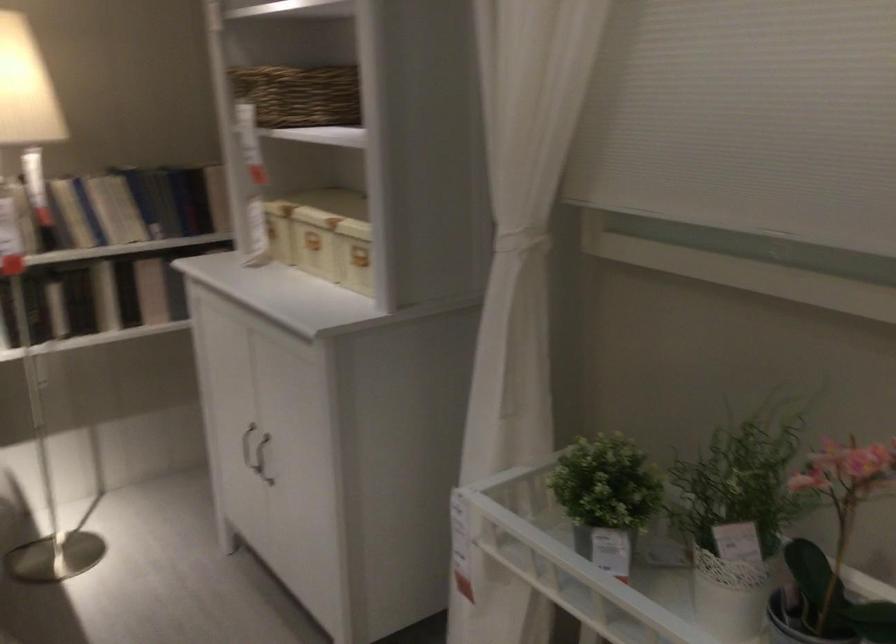
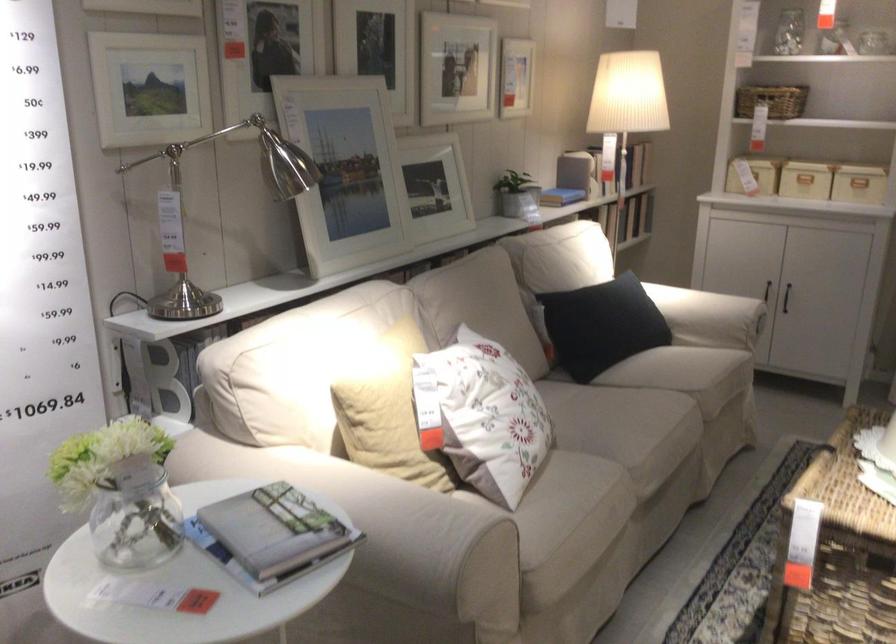
The point at (224, 286) is marked in the first image. Where is the corresponding point in the second image?

(805, 180)